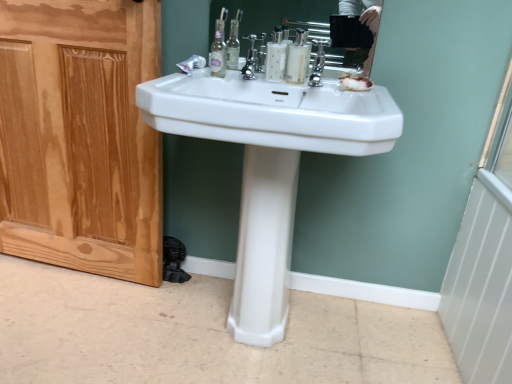
At what (x,y) coordinates should I click in order to perform the action: click on vacant area that lies in front of white glossy pedestal at center. Please return your answer as a coordinate pair (x, y). Looking at the image, I should click on (256, 364).